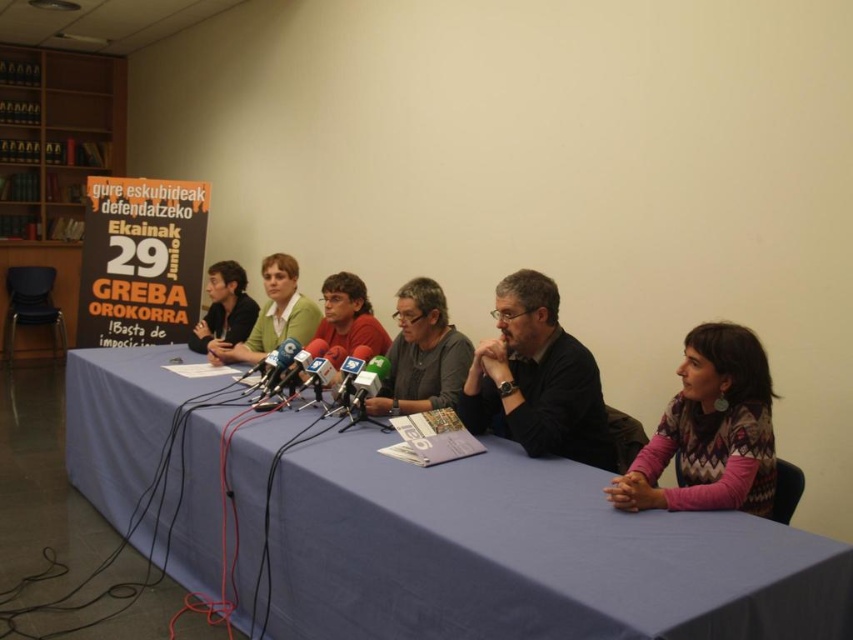
You are a photographer at the press conference. You need to capture a clear photo of the blue fabric table at center and the red matte shirt at center. Which object should you focus on first to ensure depth of field?

The blue fabric table at center is taller than the red matte shirt at center, so you should focus on the blue fabric table at center first to ensure both are in focus.

From the picture: You are a photographer attending a press conference and need to capture a photo of the dark gray sweater at center without including the wooden bookshelf at left in the frame. Is this possible based on their positions?

The wooden bookshelf at left is positioned on the left side of dark gray sweater at center, so if you position yourself to the right of the dark gray sweater at center and aim your camera away from the wooden bookshelf at left, you can capture the dark gray sweater at center without including the bookshelf in the frame.